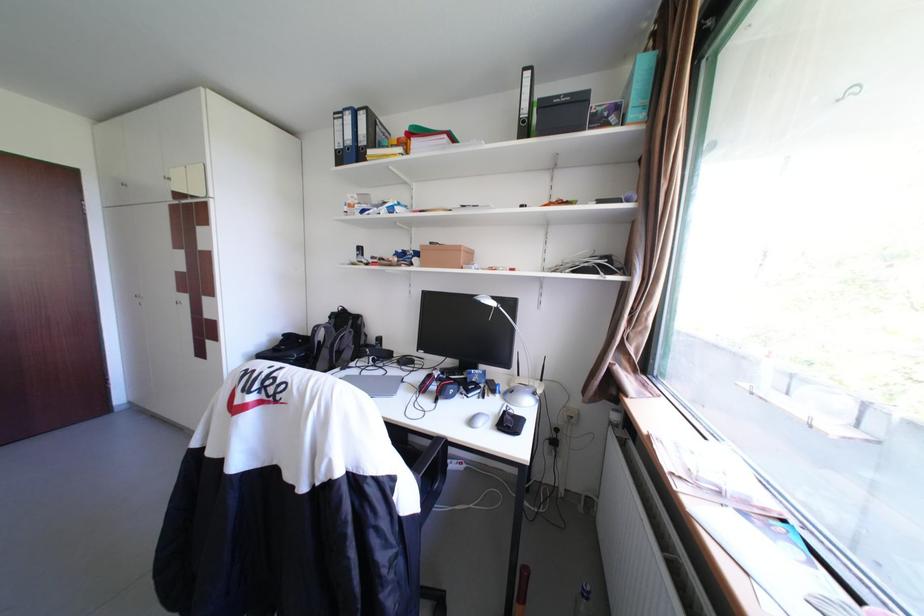
Where is `cardboard box`? cardboard box is located at coordinates (444, 256).